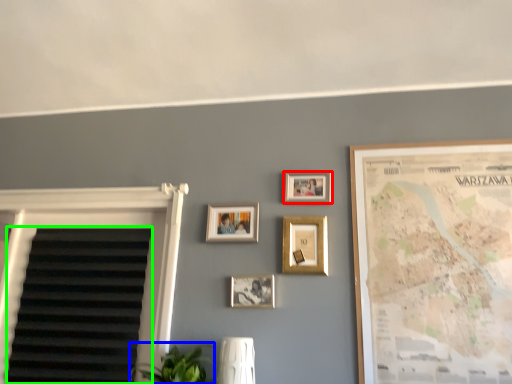
Question: Which is farther away from picture frame (highlighted by a red box)? plant (highlighted by a blue box) or blind (highlighted by a green box)?

Choices:
 (A) plant
 (B) blind

Answer: (B)